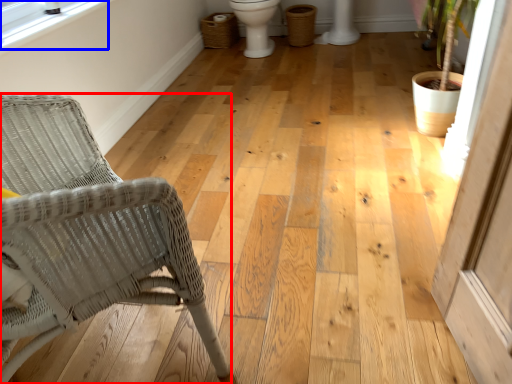
Question: Which object is further to the camera taking this photo, chair (highlighted by a red box) or window screen (highlighted by a blue box)?

Choices:
 (A) chair
 (B) window screen

Answer: (B)